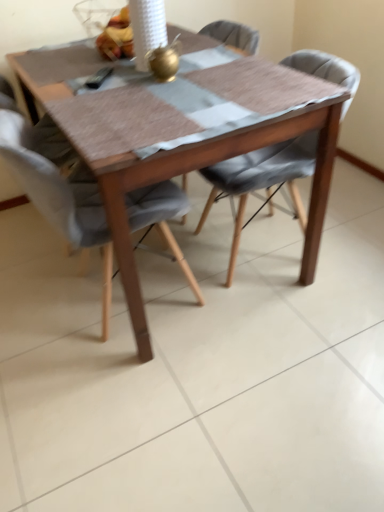
Question: Is wooden table at center to the left of textured gray cushioned chair at center, the 1th chair positioned from the right, from the viewer's perspective?

Choices:
 (A) yes
 (B) no

Answer: (A)

Question: Is wooden table at center oriented away from textured gray cushioned chair at center, the second chair viewed from the left?

Choices:
 (A) no
 (B) yes

Answer: (A)

Question: Is wooden table at center wider than textured gray cushioned chair at center, the 1th chair positioned from the right?

Choices:
 (A) no
 (B) yes

Answer: (B)

Question: Is wooden table at center further to the viewer compared to textured gray cushioned chair at center, the 1th chair positioned from the right?

Choices:
 (A) yes
 (B) no

Answer: (B)

Question: Is wooden table at center taller than textured gray cushioned chair at center, the second chair viewed from the left?

Choices:
 (A) no
 (B) yes

Answer: (B)

Question: In terms of size, does light gray fabric chair at center, marked as the second chair in a right-to-left arrangement, appear bigger or smaller than wooden table at center?

Choices:
 (A) small
 (B) big

Answer: (A)

Question: From a real-world perspective, is light gray fabric chair at center, marked as the second chair in a right-to-left arrangement, physically located above or below wooden table at center?

Choices:
 (A) above
 (B) below

Answer: (A)

Question: Considering the positions of light gray fabric chair at center, marked as the second chair in a right-to-left arrangement, and wooden table at center in the image, is light gray fabric chair at center, marked as the second chair in a right-to-left arrangement, wider or thinner than wooden table at center?

Choices:
 (A) wide
 (B) thin

Answer: (B)

Question: Is light gray fabric chair at center, marked as the second chair in a right-to-left arrangement, taller or shorter than wooden table at center?

Choices:
 (A) short
 (B) tall

Answer: (B)

Question: From a real-world perspective, is shiny plastic bag of fruits at upper center positioned above or below light gray fabric chair at center, marked as the second chair in a right-to-left arrangement?

Choices:
 (A) below
 (B) above

Answer: (B)

Question: Does point (122, 15) appear closer or farther from the camera than point (170, 209)?

Choices:
 (A) closer
 (B) farther

Answer: (B)

Question: Considering the positions of shiny plastic bag of fruits at upper center and light gray fabric chair at center, which appears as the first chair when viewed from the left, in the image, is shiny plastic bag of fruits at upper center bigger or smaller than light gray fabric chair at center, which appears as the first chair when viewed from the left,?

Choices:
 (A) big
 (B) small

Answer: (B)

Question: From their relative heights in the image, would you say shiny plastic bag of fruits at upper center is taller or shorter than light gray fabric chair at center, marked as the second chair in a right-to-left arrangement?

Choices:
 (A) short
 (B) tall

Answer: (A)

Question: Is wooden table at center wider or thinner than light gray fabric chair at center, which appears as the first chair when viewed from the left?

Choices:
 (A) wide
 (B) thin

Answer: (A)

Question: Based on their sizes in the image, would you say wooden table at center is bigger or smaller than light gray fabric chair at center, which appears as the first chair when viewed from the left?

Choices:
 (A) big
 (B) small

Answer: (A)